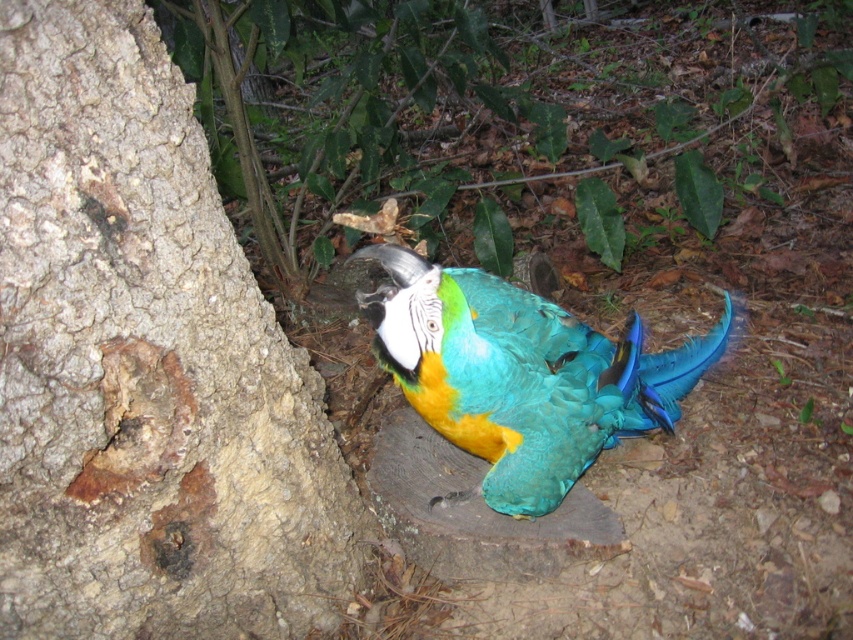
You are standing in front of the parrot and want to place a small treat between the two points, point (x=90, y=436) and point (x=483, y=433). Which point should you aim for to ensure the treat is closer to you?

You should aim for point (x=90, y=436) because it is closer to the viewer than point (x=483, y=433).

Based on the scene description, where is the rough bark tree trunk at left located in the image?

The rough bark tree trunk at left is located at point 2D coordinates of (144, 364).